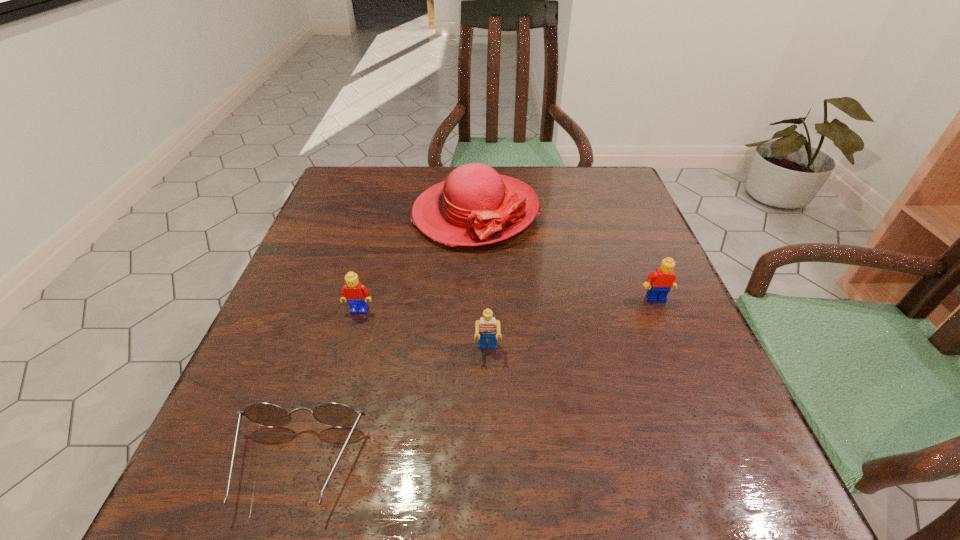
Find the location of a particular element. This screenshot has width=960, height=540. free point between the leftmost Lego and the shortest object is located at coordinates (328, 387).

Locate an element on the screen. The width and height of the screenshot is (960, 540). free area in between the farthest object and the fourth farthest object is located at coordinates (481, 281).

Find the location of `free point between the tallest object and the second farthest object`. free point between the tallest object and the second farthest object is located at coordinates (565, 255).

Locate an element on the screen. The width and height of the screenshot is (960, 540). vacant space in between the spectacles and the rightmost Lego is located at coordinates (476, 382).

Locate an element on the screen. The height and width of the screenshot is (540, 960). vacant area that lies between the rightmost object and the leftmost Lego is located at coordinates (508, 304).

Identify the location of free space between the second Lego from left to right and the spectacles. This screenshot has height=540, width=960. (392, 408).

Locate an element on the screen. object that can be found as the closest to the leftmost Lego is located at coordinates (474, 206).

At what (x,y) coordinates should I click in order to perform the action: click on the second closest object to the nearest Lego. Please return your answer as a coordinate pair (x, y). Looking at the image, I should click on (356, 294).

Locate an element on the screen. This screenshot has width=960, height=540. the second closest Lego relative to the second Lego from left to right is located at coordinates pos(663,279).

Identify which Lego is the second nearest to the second Lego from left to right. Please provide its 2D coordinates. Your answer should be formatted as a tuple, i.e. [(x, y)], where the tuple contains the x and y coordinates of a point satisfying the conditions above.

[(663, 279)]